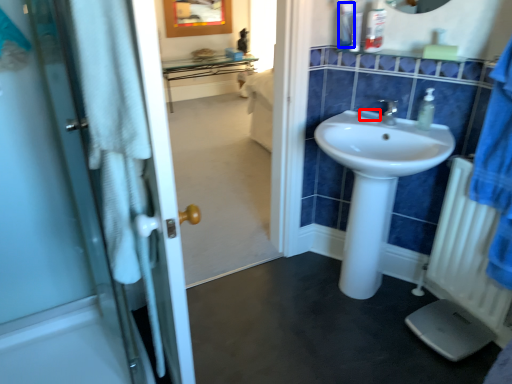
Question: Which object is closer to the camera taking this photo, soap (highlighted by a red box) or toiletry (highlighted by a blue box)?

Choices:
 (A) soap
 (B) toiletry

Answer: (B)